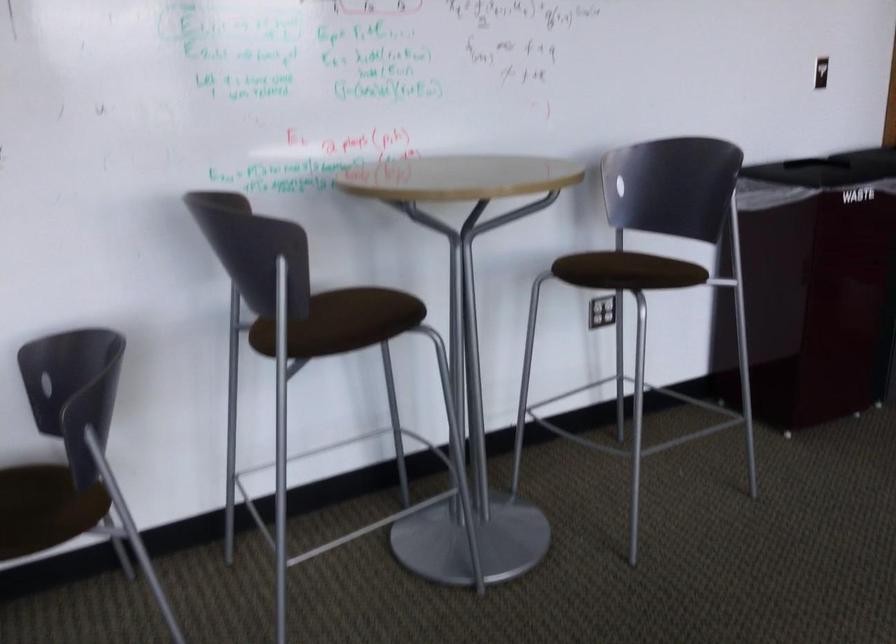
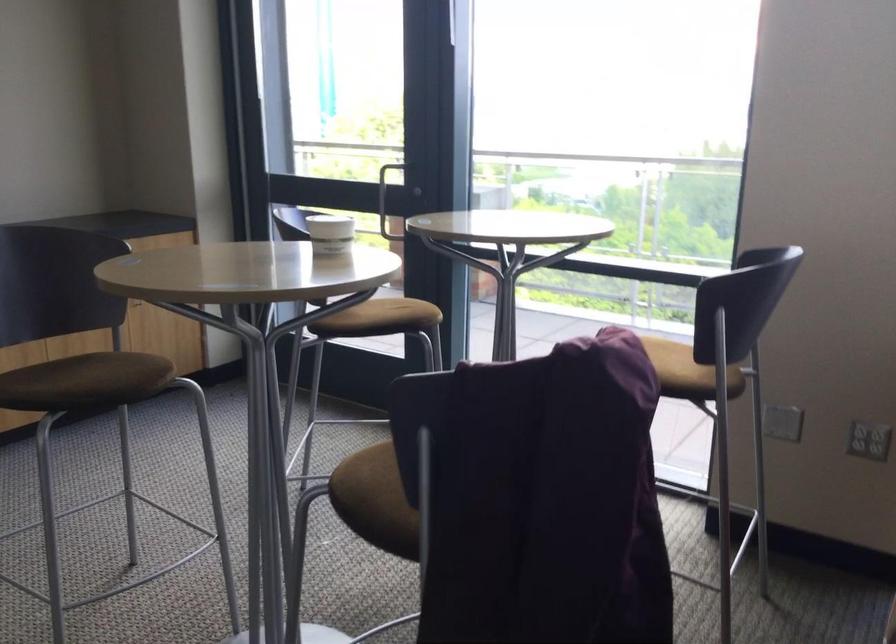
First-person continuous shooting, in which direction is the camera rotating?

The rotation direction of the camera is right-down.